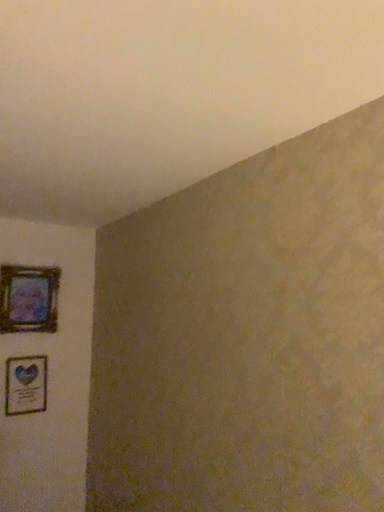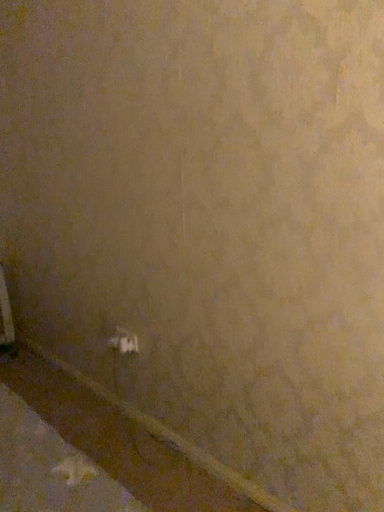
Question: How did the camera likely rotate when shooting the video?

Choices:
 (A) rotated right
 (B) rotated left

Answer: (A)